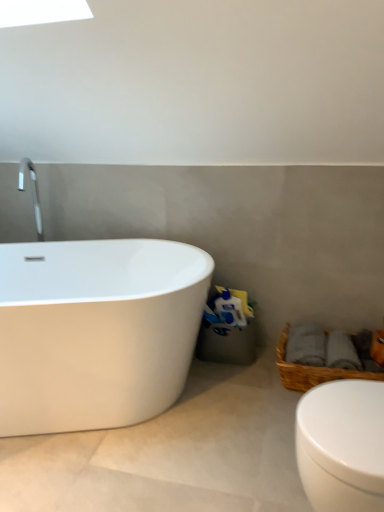
Question: Is white glossy toilet at lower right positioned beyond the bounds of woven brown basket at lower right?

Choices:
 (A) yes
 (B) no

Answer: (A)

Question: Does white glossy toilet at lower right have a greater width compared to woven brown basket at lower right?

Choices:
 (A) no
 (B) yes

Answer: (A)

Question: Is white glossy toilet at lower right oriented towards woven brown basket at lower right?

Choices:
 (A) no
 (B) yes

Answer: (A)

Question: Are white glossy toilet at lower right and woven brown basket at lower right making contact?

Choices:
 (A) yes
 (B) no

Answer: (B)

Question: Is white glossy toilet at lower right far from woven brown basket at lower right?

Choices:
 (A) yes
 (B) no

Answer: (B)

Question: From the image's perspective, is woven brown basket at lower right positioned above or below white glossy toilet at lower right?

Choices:
 (A) above
 (B) below

Answer: (A)

Question: Is woven brown basket at lower right taller or shorter than white glossy toilet at lower right?

Choices:
 (A) short
 (B) tall

Answer: (A)

Question: From a real-world perspective, relative to white glossy toilet at lower right, is woven brown basket at lower right vertically above or below?

Choices:
 (A) below
 (B) above

Answer: (A)

Question: Relative to white glossy toilet at lower right, is woven brown basket at lower right in front or behind?

Choices:
 (A) front
 (B) behind

Answer: (B)

Question: Is white glossy toilet at lower right bigger or smaller than woven brown basket at lower right?

Choices:
 (A) big
 (B) small

Answer: (B)

Question: Is white glossy toilet at lower right in front of or behind woven brown basket at lower right in the image?

Choices:
 (A) front
 (B) behind

Answer: (A)

Question: From a real-world perspective, is white glossy toilet at lower right above or below woven brown basket at lower right?

Choices:
 (A) below
 (B) above

Answer: (B)

Question: From the image's perspective, is white glossy toilet at lower right above or below woven brown basket at lower right?

Choices:
 (A) below
 (B) above

Answer: (A)

Question: Relative to white glossy toilet at lower right, is white glossy bathtub at left in front or behind?

Choices:
 (A) front
 (B) behind

Answer: (B)

Question: From a real-world perspective, is white glossy bathtub at left above or below white glossy toilet at lower right?

Choices:
 (A) below
 (B) above

Answer: (B)